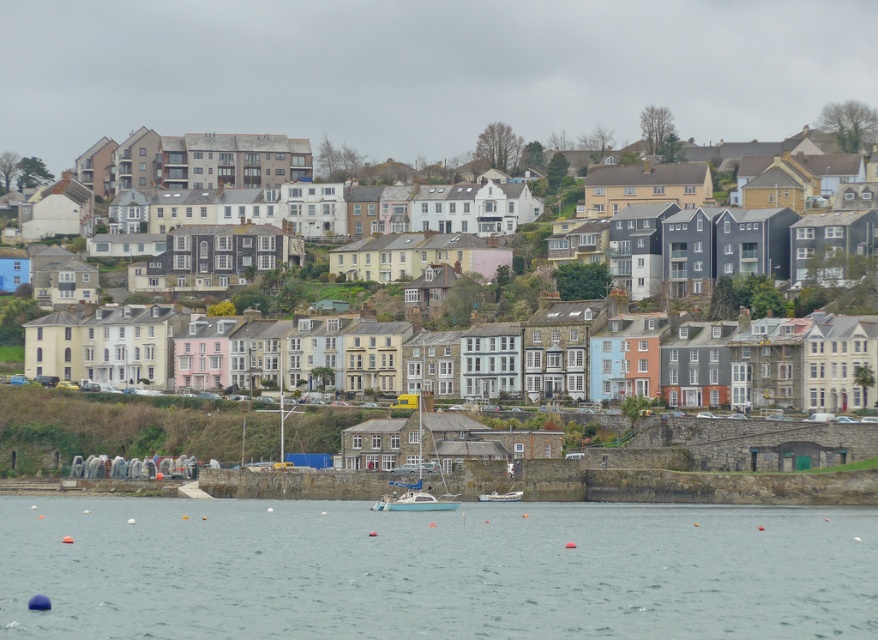
Question: Is clear water at lower center in front of light blue plastic boat at center?

Choices:
 (A) no
 (B) yes

Answer: (B)

Question: Which of the following is the farthest from the observer?

Choices:
 (A) white plastic boat at center
 (B) light blue plastic boat at center
 (C) clear water at lower center

Answer: (A)

Question: Does clear water at lower center lie behind white plastic boat at center?

Choices:
 (A) yes
 (B) no

Answer: (B)

Question: Is clear water at lower center to the right of light blue plastic boat at center from the viewer's perspective?

Choices:
 (A) no
 (B) yes

Answer: (B)

Question: Which object is the closest to the white plastic boat at center?

Choices:
 (A) light blue plastic boat at center
 (B) clear water at lower center

Answer: (A)

Question: Which point is closer to the camera taking this photo?

Choices:
 (A) (427, 492)
 (B) (776, 595)

Answer: (B)